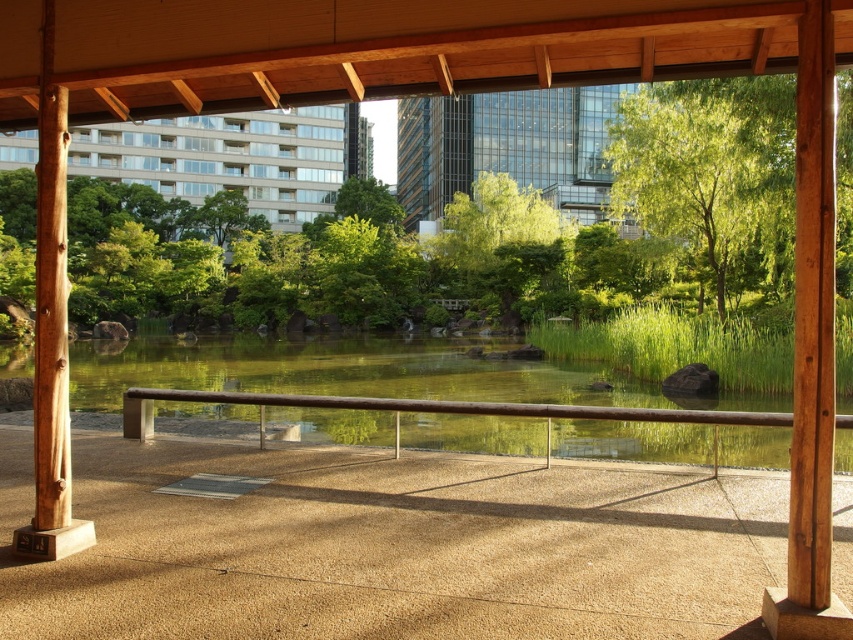
Question: Can you confirm if green leafy tree at upper right is wider than brown wood rail at center?

Choices:
 (A) no
 (B) yes

Answer: (B)

Question: Does green leafy tree at upper right appear under brown wood rail at center?

Choices:
 (A) no
 (B) yes

Answer: (A)

Question: Which point appears closest to the camera in this image?

Choices:
 (A) (668, 195)
 (B) (144, 420)

Answer: (B)

Question: Can you confirm if green leafy tree at upper right is thinner than brown wood rail at center?

Choices:
 (A) no
 (B) yes

Answer: (A)